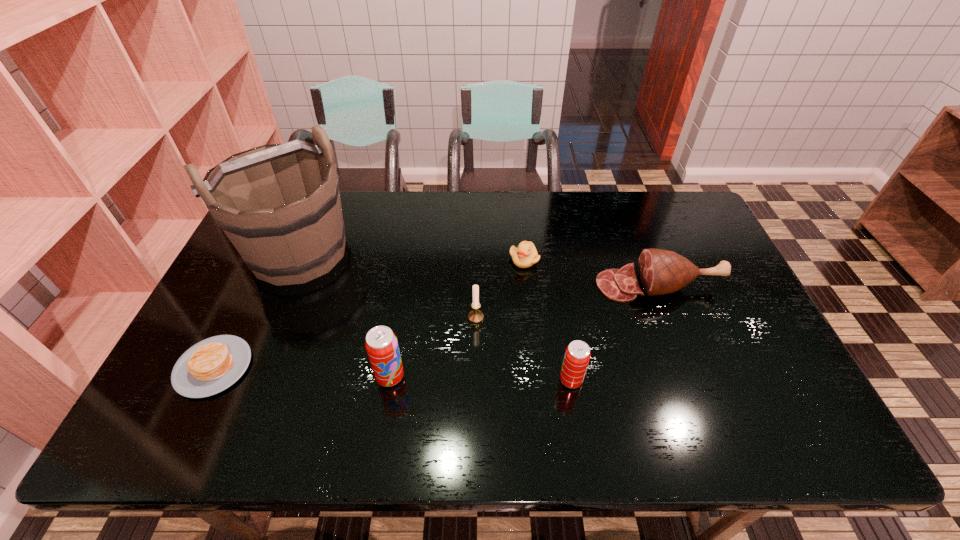
Given the evenly spaced soda cans in the image, where should an extra soda can be added on the right to preserve the spacing? Please point to a vacant space. Please provide its 2D coordinates. Your answer should be formatted as a tuple, i.e. [(x, y)], where the tuple contains the x and y coordinates of a point satisfying the conditions above.

[(755, 384)]